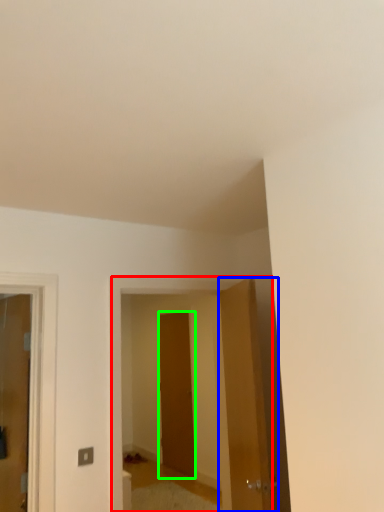
Question: Estimate the real-world distances between objects in this image. Which object is farther from elevator (highlighted by a red box), door (highlighted by a blue box) or door (highlighted by a green box)?

Choices:
 (A) door
 (B) door

Answer: (B)